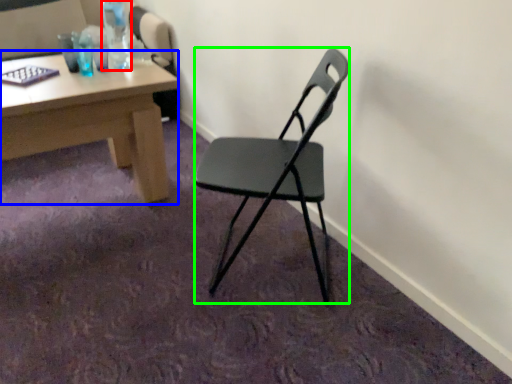
Question: Considering the real-world distances, which object is farthest from bottle (highlighted by a red box)? desk (highlighted by a blue box) or chair (highlighted by a green box)?

Choices:
 (A) desk
 (B) chair

Answer: (B)